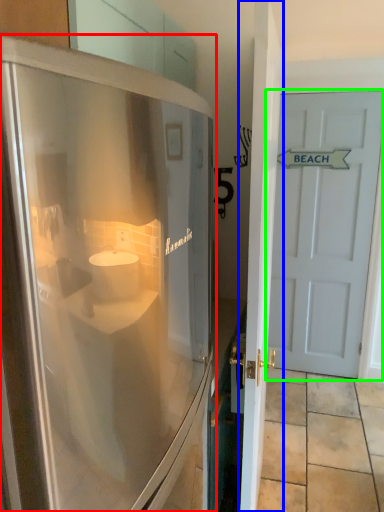
Question: Based on their relative distances, which object is farther from refrigerator (highlighted by a red box)? Choose from door (highlighted by a blue box) and door (highlighted by a green box).

Choices:
 (A) door
 (B) door

Answer: (B)